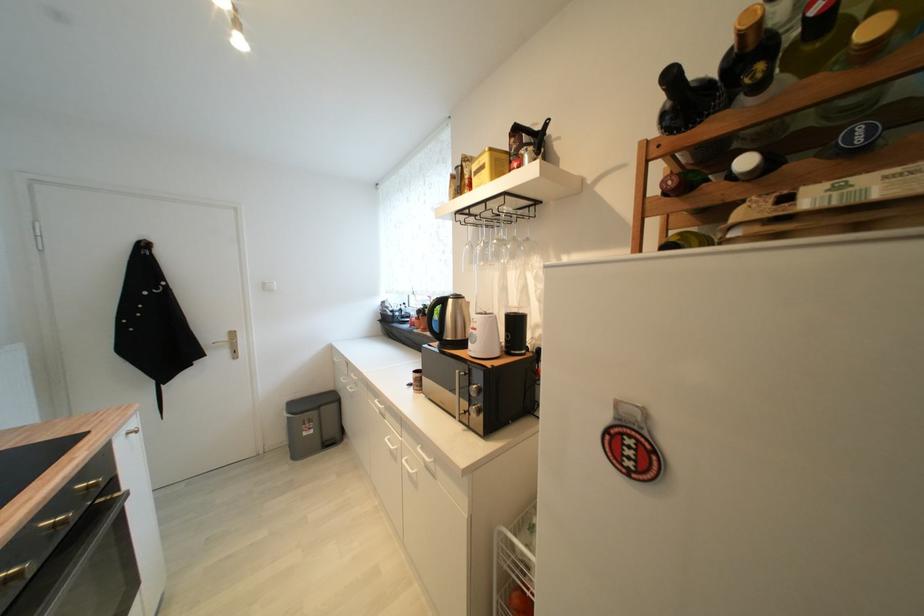
Find the location of a particular element. The image size is (924, 616). gold door handle is located at coordinates (229, 342).